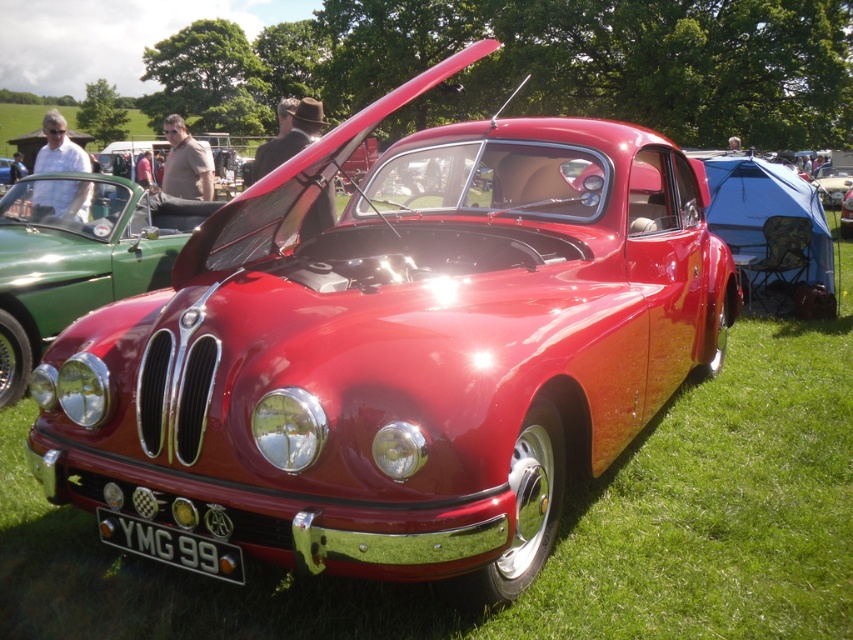
You are a photographer trying to capture the license plate of the car at the car show. The license plate is located at point (170, 545). Where exactly on the car should you focus your camera to ensure you get a clear shot of the license plate?

The license plate is located at point (170, 545), which is the black metallic license plate at center. Therefore, you should focus your camera on the black metallic license plate at center to capture it clearly.